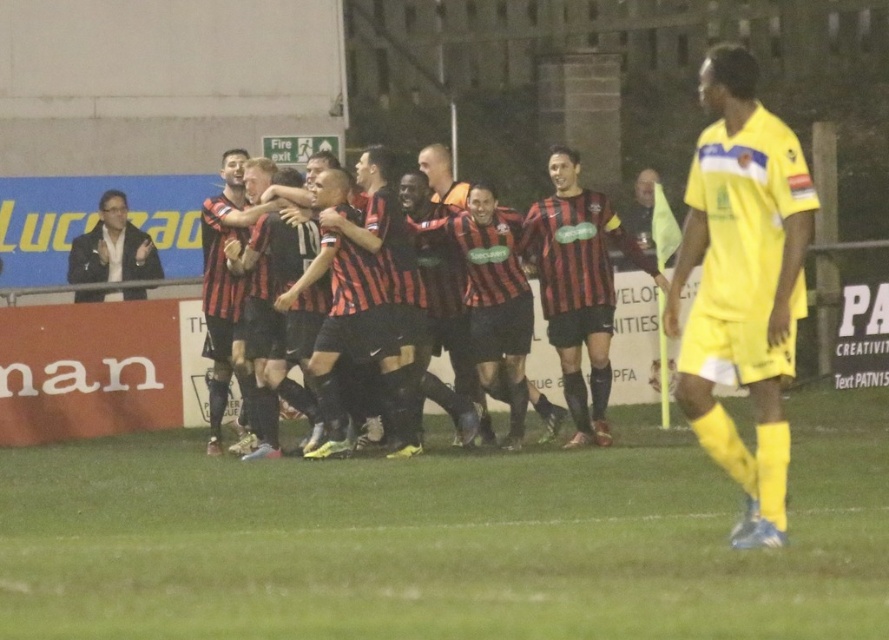
You are a soccer referee standing at the edge of the field. You see the green grass at center and the striped jersey at center. Which object is closer to you?

The green grass at center is closer to you because it is in front of the striped jersey at center.

You are a soccer player standing on the green grass at center. You want to throw a ball to a teammate wearing a black leather jacket at left. The ball you have can travel up to 4 meters. Do you think you can successfully throw it to them?

The distance between the green grass at center and the black leather jacket at left is 3.95 meters. Since the ball can travel up to 4 meters, you can successfully throw it to the teammate wearing the black leather jacket at left.

You are a soccer player standing at the point marked by the coordinates point (446, 540). You want to join your teammates who are celebrating in the midground. Which direction should you move to reach them?

The point (446, 540) is on green grass at center. Since the celebrating teammates are in the midground, you should move forward towards the midground to reach them.